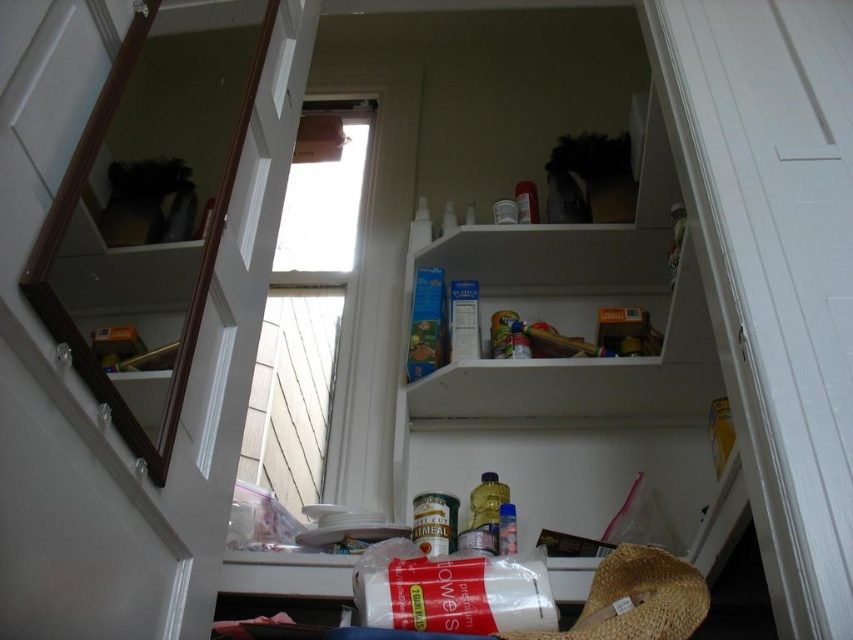
Question: Is white matte shelf at upper center in front of brown woven straw hat at lower right?

Choices:
 (A) yes
 (B) no

Answer: (B)

Question: Which of the following is the closest to the observer?

Choices:
 (A) (566, 636)
 (B) (550, 257)

Answer: (A)

Question: Is white matte shelf at upper center to the right of brown woven straw hat at lower right from the viewer's perspective?

Choices:
 (A) no
 (B) yes

Answer: (B)

Question: Can you confirm if white matte shelf at upper center is positioned to the right of brown woven straw hat at lower right?

Choices:
 (A) no
 (B) yes

Answer: (B)